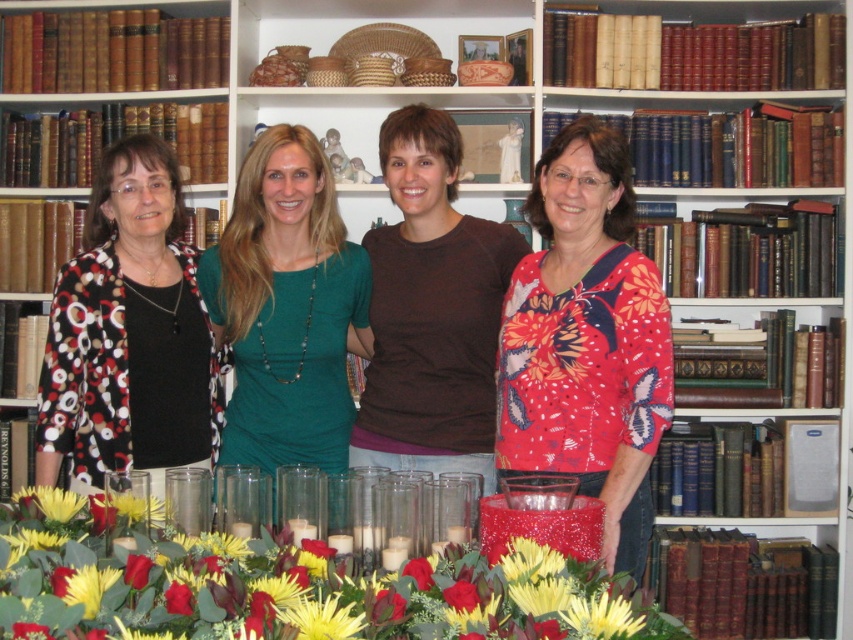
Question: Does printed fabric blouse at left have a lesser width compared to teal jersey at center?

Choices:
 (A) no
 (B) yes

Answer: (B)

Question: Does floral print blouse at center appear on the right side of teal jersey at center?

Choices:
 (A) yes
 (B) no

Answer: (A)

Question: Based on their relative distances, which object is nearer to the teal jersey at center?

Choices:
 (A) brown cotton shirt at center
 (B) glossy glass vase at lower center

Answer: (A)

Question: Does teal jersey at center have a smaller size compared to yellow matte flower at center?

Choices:
 (A) yes
 (B) no

Answer: (B)

Question: Among these objects, which one is nearest to the camera?

Choices:
 (A) printed fabric blouse at left
 (B) floral print blouse at center

Answer: (B)

Question: Considering the real-world distances, which object is farthest from the yellow matte flower at center?

Choices:
 (A) brown cotton shirt at center
 (B) teal jersey at center
 (C) printed fabric blouse at left
 (D) floral print blouse at center

Answer: (C)